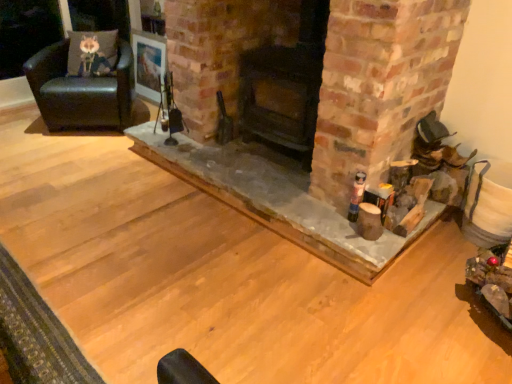
Question: Is wooden frame at upper center turned away from smooth stone fireplace at center, which is the second fireplace in right-to-left order?

Choices:
 (A) no
 (B) yes

Answer: (A)

Question: Is wooden frame at upper center wider than smooth stone fireplace at center, which is the second fireplace in right-to-left order?

Choices:
 (A) no
 (B) yes

Answer: (A)

Question: From the image's perspective, is wooden frame at upper center located above smooth stone fireplace at center, which is the 1th fireplace in left-to-right order?

Choices:
 (A) yes
 (B) no

Answer: (A)

Question: Does wooden frame at upper center appear on the right side of smooth stone fireplace at center, which is the second fireplace in right-to-left order?

Choices:
 (A) yes
 (B) no

Answer: (B)

Question: Is wooden frame at upper center far away from smooth stone fireplace at center, which is the 1th fireplace in left-to-right order?

Choices:
 (A) no
 (B) yes

Answer: (B)

Question: Is smooth stone fireplace at center, which is the second fireplace in right-to-left order, in front of or behind dark brown wood stove at center, positioned as the 1th fireplace in right-to-left order, in the image?

Choices:
 (A) behind
 (B) front

Answer: (B)

Question: In terms of width, does smooth stone fireplace at center, which is the second fireplace in right-to-left order, look wider or thinner when compared to dark brown wood stove at center, which appears as the second fireplace when viewed from the left?

Choices:
 (A) thin
 (B) wide

Answer: (B)

Question: Based on their positions, is smooth stone fireplace at center, which is the 1th fireplace in left-to-right order, located to the left or right of dark brown wood stove at center, positioned as the 1th fireplace in right-to-left order?

Choices:
 (A) left
 (B) right

Answer: (A)

Question: Is smooth stone fireplace at center, which is the second fireplace in right-to-left order, bigger or smaller than dark brown wood stove at center, which appears as the second fireplace when viewed from the left?

Choices:
 (A) big
 (B) small

Answer: (A)

Question: Considering the positions of dark brown wood stove at center, positioned as the 1th fireplace in right-to-left order, and smooth stone fireplace at center, which is the second fireplace in right-to-left order, in the image, is dark brown wood stove at center, positioned as the 1th fireplace in right-to-left order, wider or thinner than smooth stone fireplace at center, which is the second fireplace in right-to-left order,?

Choices:
 (A) wide
 (B) thin

Answer: (B)

Question: Based on their positions, is dark brown wood stove at center, positioned as the 1th fireplace in right-to-left order, located to the left or right of smooth stone fireplace at center, which is the 1th fireplace in left-to-right order?

Choices:
 (A) left
 (B) right

Answer: (B)

Question: From the image's perspective, is dark brown wood stove at center, positioned as the 1th fireplace in right-to-left order, above or below smooth stone fireplace at center, which is the second fireplace in right-to-left order?

Choices:
 (A) below
 (B) above

Answer: (B)

Question: From a real-world perspective, relative to smooth stone fireplace at center, which is the 1th fireplace in left-to-right order, is dark brown wood stove at center, positioned as the 1th fireplace in right-to-left order, vertically above or below?

Choices:
 (A) below
 (B) above

Answer: (B)

Question: In terms of size, does fuzzy fabric pillow at upper left appear bigger or smaller than dark brown wood stove at center, positioned as the 1th fireplace in right-to-left order?

Choices:
 (A) big
 (B) small

Answer: (B)

Question: Considering the positions of fuzzy fabric pillow at upper left and dark brown wood stove at center, positioned as the 1th fireplace in right-to-left order, in the image, is fuzzy fabric pillow at upper left taller or shorter than dark brown wood stove at center, positioned as the 1th fireplace in right-to-left order,?

Choices:
 (A) tall
 (B) short

Answer: (B)